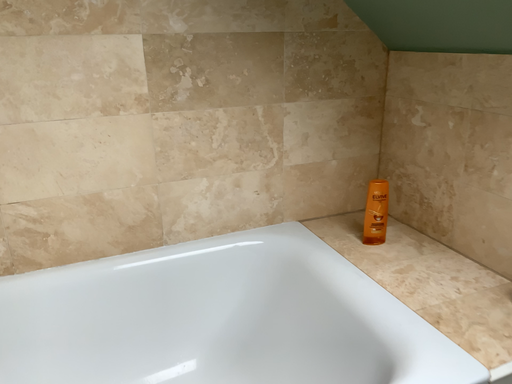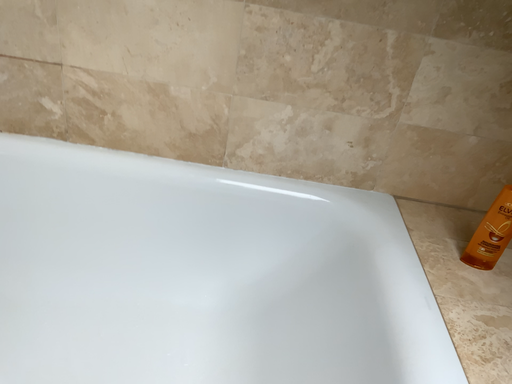
Question: Which way did the camera rotate in the video?

Choices:
 (A) rotated upward
 (B) rotated downward

Answer: (B)